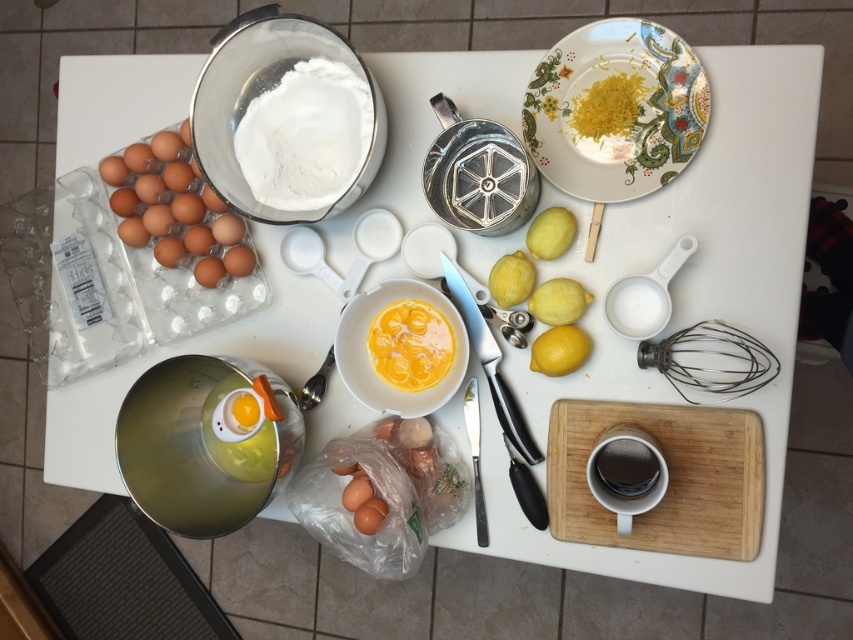
Question: Estimate the real-world distances between objects in this image. Which object is closer to the yellow matte lemon at center-right?

Choices:
 (A) yellow powder at upper right
 (B) yellow smooth egg yolk at center

Answer: (B)

Question: Does black wire whisk at lower right have a smaller size compared to yellow smooth egg yolk at center?

Choices:
 (A) no
 (B) yes

Answer: (A)

Question: Among these objects, which one is nearest to the camera?

Choices:
 (A) white powder flour at upper left
 (B) wooden cutting board at bottom right
 (C) black wire whisk at lower right

Answer: (C)

Question: Does wooden cutting board at bottom right appear under brown matte egg at left?

Choices:
 (A) yes
 (B) no

Answer: (A)

Question: Estimate the real-world distances between objects in this image. Which object is farther from the wooden cutting board at bottom right?

Choices:
 (A) black wire whisk at lower right
 (B) yellow smooth egg yolk at center
 (C) yellow matte lemon at center-right
 (D) yellow powder at upper right

Answer: (D)

Question: Can you confirm if floral ceramic plate at upper right is positioned below white powder flour at upper left?

Choices:
 (A) yes
 (B) no

Answer: (B)